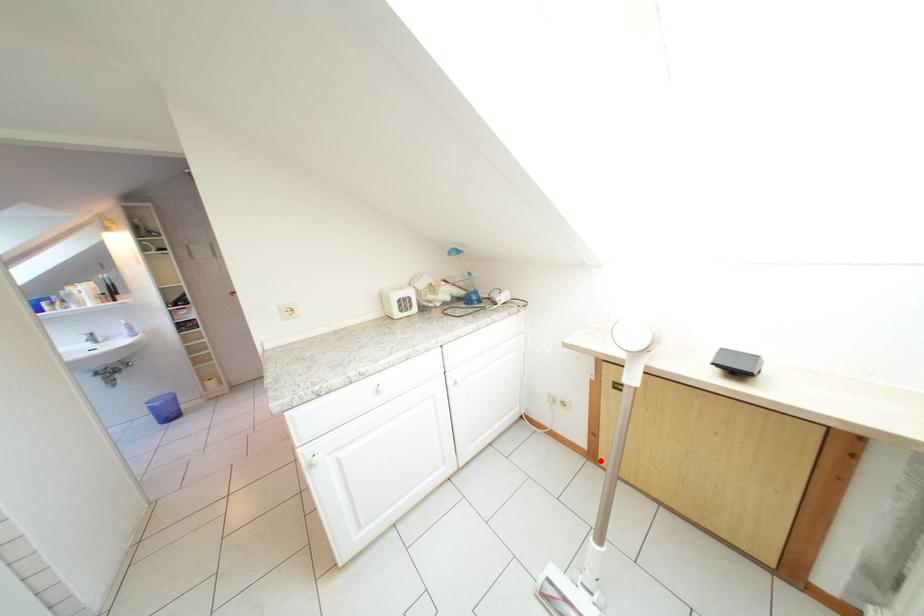
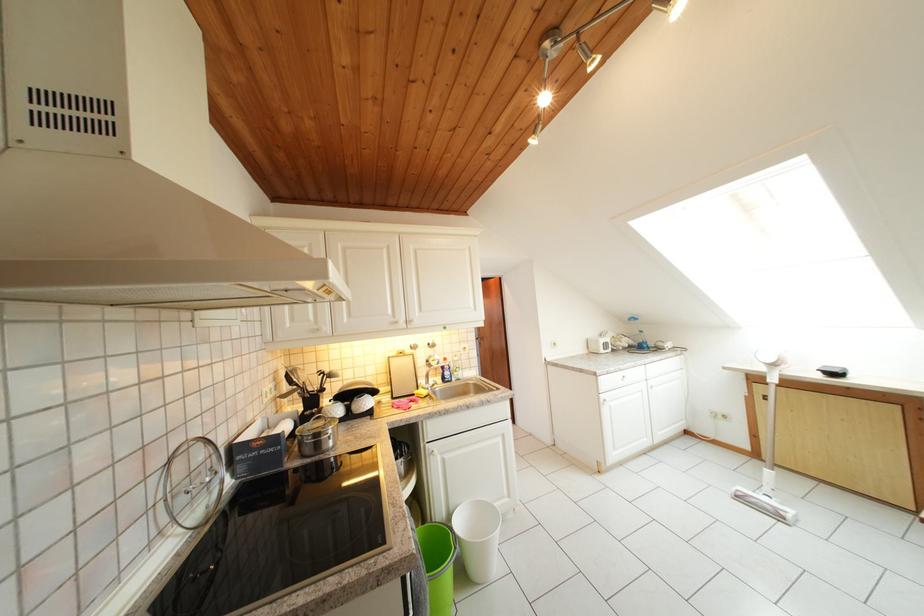
Question: I am providing you with two images of the same scene from different viewpoints. In image1, a red point is highlighted. Considering the same 3D point in image2, which of the following is correct?

Choices:
 (A) It is closer
 (B) It is farther

Answer: (A)